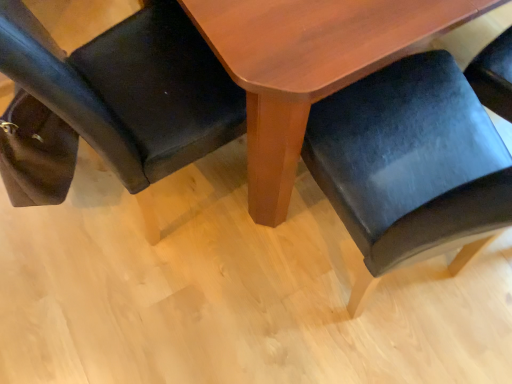
I want to click on free space that is in between wooden table at center and matte black chair at lower left, marked as the 2th chair in a right-to-left arrangement, so click(209, 251).